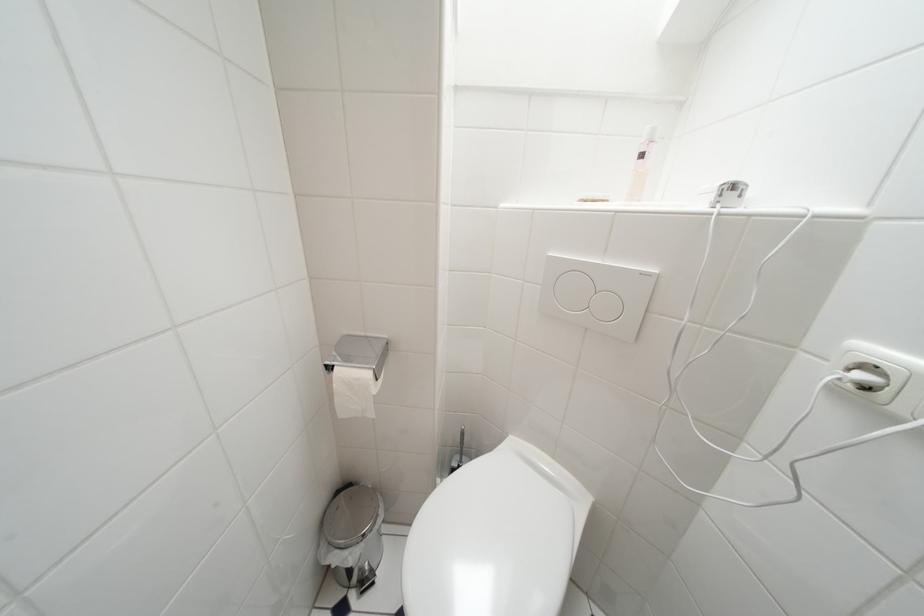
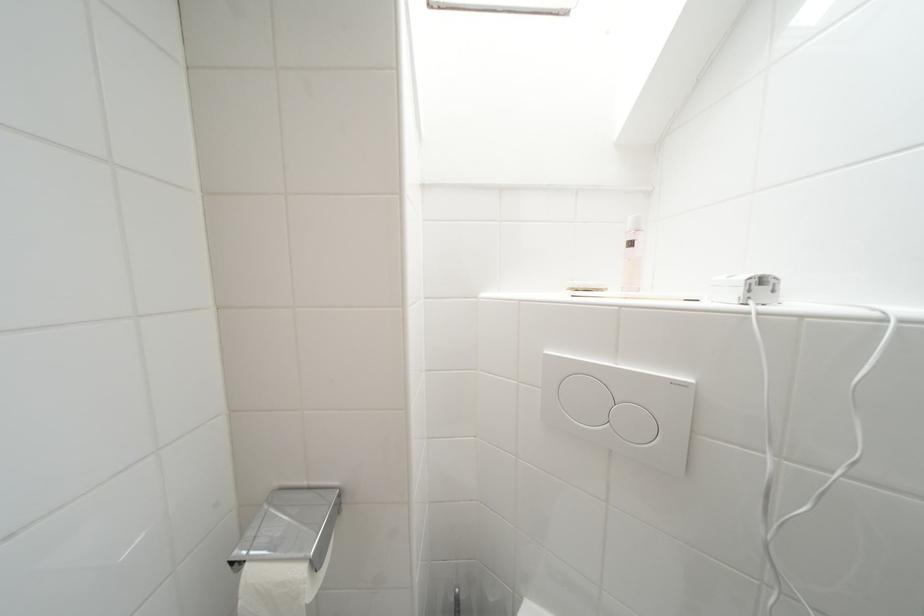
In the second image, find the point that corresponds to point (649, 160) in the first image.

(638, 246)